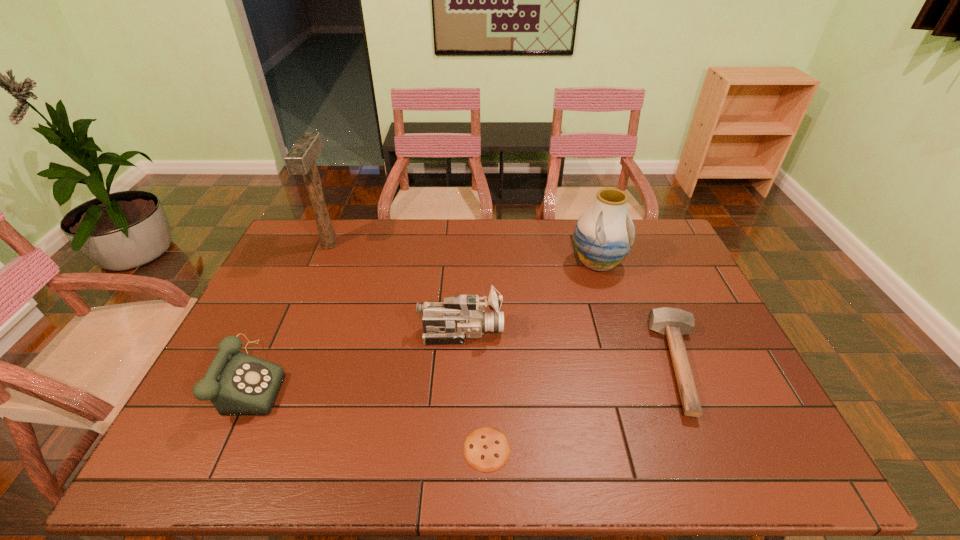
Identify the location of vacant space located 0.240m on the front of the vase. The height and width of the screenshot is (540, 960). (622, 339).

This screenshot has height=540, width=960. Identify the location of free point located 0.350m on the front-facing side of the camcorder. (626, 332).

I want to click on free space located 0.060m on the dial of the telephone, so click(x=308, y=380).

Image resolution: width=960 pixels, height=540 pixels. What are the coordinates of `free location located on the back of the fifth tallest object` in the screenshot? It's located at (654, 295).

The height and width of the screenshot is (540, 960). Find the location of `free space located 0.320m on the right of the shortest object`. free space located 0.320m on the right of the shortest object is located at coordinates (653, 449).

Identify the location of mallet located at the far edge. (300, 160).

Find the location of a particular element. This screenshot has width=960, height=540. vase at the far edge is located at coordinates (604, 234).

Where is `object that is at the near edge`? object that is at the near edge is located at coordinates (486, 449).

This screenshot has width=960, height=540. Find the location of `mallet present at the left edge`. mallet present at the left edge is located at coordinates click(x=300, y=160).

At what (x,y) coordinates should I click in order to perform the action: click on telephone that is at the left edge. Please return your answer as a coordinate pair (x, y). This screenshot has width=960, height=540. Looking at the image, I should click on (236, 383).